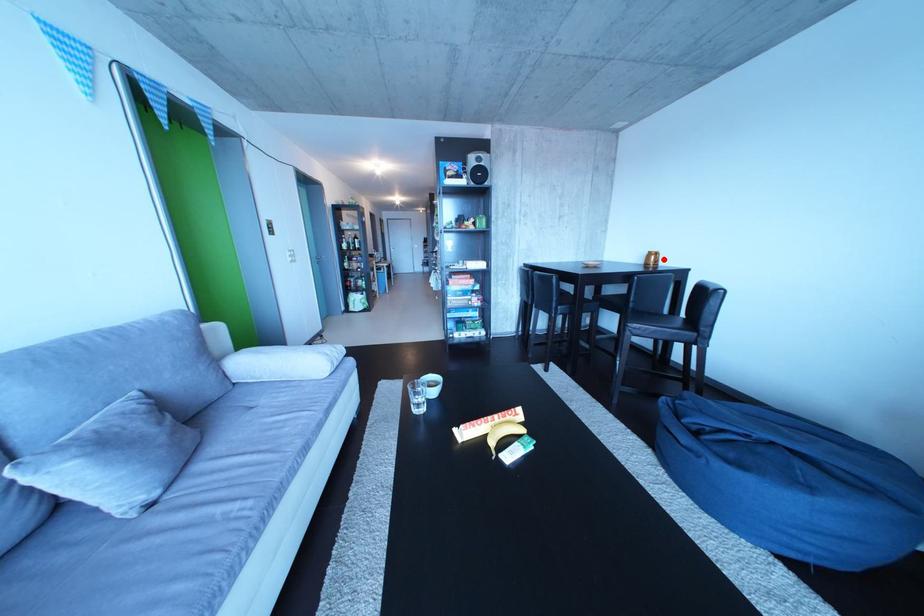
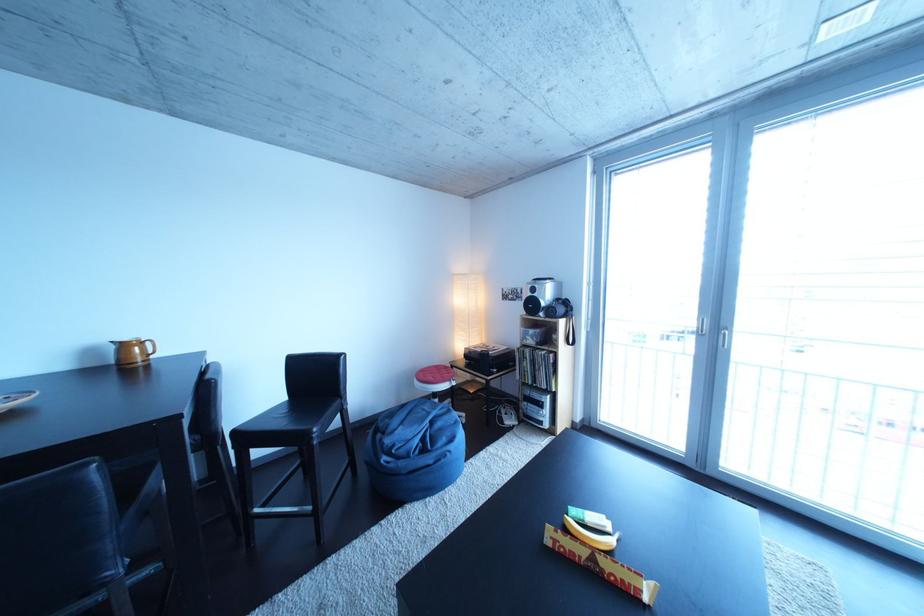
Find the pixel in the second image that matches the highlighted location in the first image.

(138, 351)